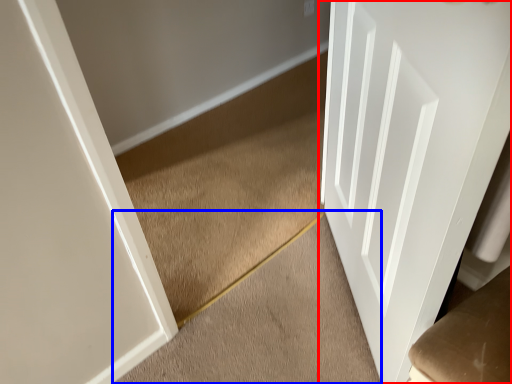
Question: Which point is closer to the camera, door (highlighted by a red box) or stairwell (highlighted by a blue box)?

Choices:
 (A) door
 (B) stairwell

Answer: (A)